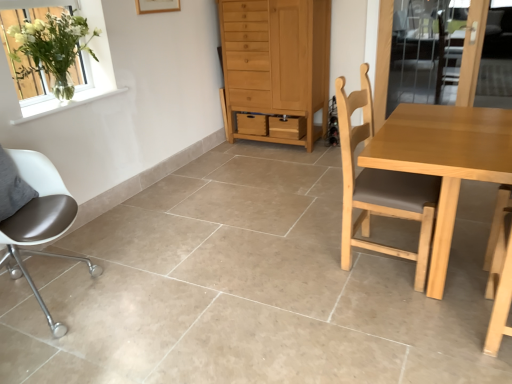
At what (x,y) coordinates should I click in order to perform the action: click on clear glass vase at upper left. Please return your answer as a coordinate pair (x, y). Looking at the image, I should click on (50, 48).

Describe the element at coordinates (380, 187) in the screenshot. I see `light brown wood chair at center, the 1th chair in the right-to-left sequence` at that location.

I want to click on light brown wooden table at right, so click(444, 160).

In order to click on clear glass vase at upper left in this screenshot , I will do `click(50, 48)`.

Measure the distance from light brown wooden table at right to light brown wood cabinet at center.

light brown wooden table at right is 5.98 feet from light brown wood cabinet at center.

From a real-world perspective, which object rests below the other?

light brown wooden table at right is physically lower.

Locate an element on the screen. cabinetry above the light brown wooden table at right (from the image's perspective) is located at coordinates (275, 67).

Choose the correct answer: Is light brown wooden table at right inside light brown wood cabinet at center or outside it?

light brown wooden table at right exists outside the volume of light brown wood cabinet at center.

Considering their positions, is light brown wood cabinet at center located in front of or behind light brown wood chair at center, the 1th chair in the right-to-left sequence?

light brown wood cabinet at center is positioned farther from the viewer than light brown wood chair at center, the 1th chair in the right-to-left sequence.

Can you tell me how much light brown wood cabinet at center and light brown wood chair at center, the 1th chair in the right-to-left sequence, differ in facing direction?

The angle between the facing direction of light brown wood cabinet at center and the facing direction of light brown wood chair at center, the 1th chair in the right-to-left sequence, is 87.2 degrees.

From a real-world perspective, between light brown wood cabinet at center and light brown wood chair at center, the 1th chair in the right-to-left sequence, who is vertically higher?

light brown wood cabinet at center, from a real-world perspective.

Consider the image. Considering the relative sizes of light brown wood cabinet at center and light brown wood chair at center, positioned as the second chair in left-to-right order, in the image provided, is light brown wood cabinet at center thinner than light brown wood chair at center, positioned as the second chair in left-to-right order,?

No, light brown wood cabinet at center is not thinner than light brown wood chair at center, positioned as the second chair in left-to-right order.

Is light brown wood chair at center, the 1th chair in the right-to-left sequence, oriented away from light brown wood cabinet at center?

No, light brown wood chair at center, the 1th chair in the right-to-left sequence, is not facing away from light brown wood cabinet at center.

Does light brown wood chair at center, positioned as the second chair in left-to-right order, touch light brown wood cabinet at center?

No, light brown wood chair at center, positioned as the second chair in left-to-right order, is not with light brown wood cabinet at center.

Is point (434, 204) farther from viewer compared to point (226, 77)?

No, it is in front of (226, 77).

Is light brown wood chair at center, the 1th chair in the right-to-left sequence, bigger than light brown wood cabinet at center?

No, light brown wood chair at center, the 1th chair in the right-to-left sequence, is not bigger than light brown wood cabinet at center.

Considering the points (318, 68) and (52, 199), which point is in front, point (318, 68) or point (52, 199)?

The point (52, 199) is more forward.

Is light brown wood cabinet at center positioned behind matte brown chair at left, the first chair when ordered from left to right?

Yes, the depth of light brown wood cabinet at center is greater than that of matte brown chair at left, the first chair when ordered from left to right.

From a real-world perspective, does light brown wood cabinet at center stand above matte brown chair at left, the first chair when ordered from left to right?

Correct, in the physical world, light brown wood cabinet at center is higher than matte brown chair at left, the first chair when ordered from left to right.

Looking at this image, is light brown wood cabinet at center located outside matte brown chair at left, positioned as the 2th chair in right-to-left order?

Yes, light brown wood cabinet at center is outside of matte brown chair at left, positioned as the 2th chair in right-to-left order.

Who is taller, matte brown chair at left, positioned as the 2th chair in right-to-left order, or light brown wood chair at center, the 1th chair in the right-to-left sequence?

light brown wood chair at center, the 1th chair in the right-to-left sequence.

Based on the photo, are matte brown chair at left, positioned as the 2th chair in right-to-left order, and light brown wood chair at center, the 1th chair in the right-to-left sequence, far apart?

Yes, matte brown chair at left, positioned as the 2th chair in right-to-left order, and light brown wood chair at center, the 1th chair in the right-to-left sequence, are located far from each other.

From a real-world perspective, which object stands above the other?

light brown wood chair at center, positioned as the second chair in left-to-right order, is physically above.

Is matte brown chair at left, positioned as the 2th chair in right-to-left order, outside of light brown wood cabinet at center?

Indeed, matte brown chair at left, positioned as the 2th chair in right-to-left order, is completely outside light brown wood cabinet at center.

Locate an element on the screen. The image size is (512, 384). cabinetry that appears above the matte brown chair at left, positioned as the 2th chair in right-to-left order (from the image's perspective) is located at coordinates (275, 67).

From the image's perspective, is matte brown chair at left, the first chair when ordered from left to right, beneath light brown wood cabinet at center?

Yes.

The width and height of the screenshot is (512, 384). I want to click on houseplant in front of the light brown wood cabinet at center, so click(50, 48).

From a real-world perspective, is clear glass vase at upper left physically located above or below light brown wood cabinet at center?

clear glass vase at upper left is situated higher than light brown wood cabinet at center in the real world.

Consider the image. Considering the sizes of objects clear glass vase at upper left and light brown wood cabinet at center in the image provided, who is thinner, clear glass vase at upper left or light brown wood cabinet at center?

Thinner between the two is clear glass vase at upper left.

Looking at this image, does clear glass vase at upper left contain light brown wood cabinet at center?

No, light brown wood cabinet at center is not a part of clear glass vase at upper left.

Locate an element on the screen. This screenshot has width=512, height=384. cabinetry on the left of the light brown wooden table at right is located at coordinates click(x=275, y=67).

Where is `cabinetry above the light brown wood chair at center, positioned as the second chair in left-to-right order (from a real-world perspective)`? cabinetry above the light brown wood chair at center, positioned as the second chair in left-to-right order (from a real-world perspective) is located at coordinates (275, 67).

Considering their positions, is clear glass screen door at upper right positioned further to clear glass vase at upper left than light brown wood chair at center, the 1th chair in the right-to-left sequence?

Based on the image, clear glass screen door at upper right appears to be further to clear glass vase at upper left.

Consider the image. Considering their positions, is clear glass screen door at upper right positioned closer to matte brown chair at left, the first chair when ordered from left to right, than clear glass vase at upper left?

Based on the image, clear glass vase at upper left appears to be nearer to matte brown chair at left, the first chair when ordered from left to right.

When comparing their distances from light brown wooden table at right, does matte brown chair at left, positioned as the 2th chair in right-to-left order, or clear glass vase at upper left seem closer?

The object closer to light brown wooden table at right is matte brown chair at left, positioned as the 2th chair in right-to-left order.

Looking at the image, which one is located closer to light brown wood chair at center, positioned as the second chair in left-to-right order, matte brown chair at left, the first chair when ordered from left to right, or light brown wooden table at right?

light brown wooden table at right.

Considering their positions, is matte brown chair at left, positioned as the 2th chair in right-to-left order, positioned closer to light brown wood chair at center, the 1th chair in the right-to-left sequence, than light brown wood cabinet at center?

Based on the image, matte brown chair at left, positioned as the 2th chair in right-to-left order, appears to be nearer to light brown wood chair at center, the 1th chair in the right-to-left sequence.

Which object lies further to the anchor point matte brown chair at left, positioned as the 2th chair in right-to-left order, clear glass vase at upper left or light brown wooden table at right?

light brown wooden table at right lies further to matte brown chair at left, positioned as the 2th chair in right-to-left order, than the other object.

Considering their positions, is light brown wooden table at right positioned closer to clear glass screen door at upper right than clear glass vase at upper left?

Based on the image, light brown wooden table at right appears to be nearer to clear glass screen door at upper right.

Estimate the real-world distances between objects in this image. Which object is closer to light brown wood cabinet at center, clear glass screen door at upper right or light brown wooden table at right?

clear glass screen door at upper right is closer to light brown wood cabinet at center.

The width and height of the screenshot is (512, 384). I want to click on cabinetry between clear glass vase at upper left and light brown wood chair at center, the 1th chair in the right-to-left sequence, from left to right, so click(x=275, y=67).

Locate an element on the screen. This screenshot has height=384, width=512. houseplant between matte brown chair at left, positioned as the 2th chair in right-to-left order, and light brown wood cabinet at center in the front-back direction is located at coordinates (50, 48).

Locate an element on the screen. cabinetry between clear glass vase at upper left and light brown wooden table at right is located at coordinates (275, 67).

I want to click on desk situated between clear glass vase at upper left and clear glass screen door at upper right from left to right, so click(444, 160).